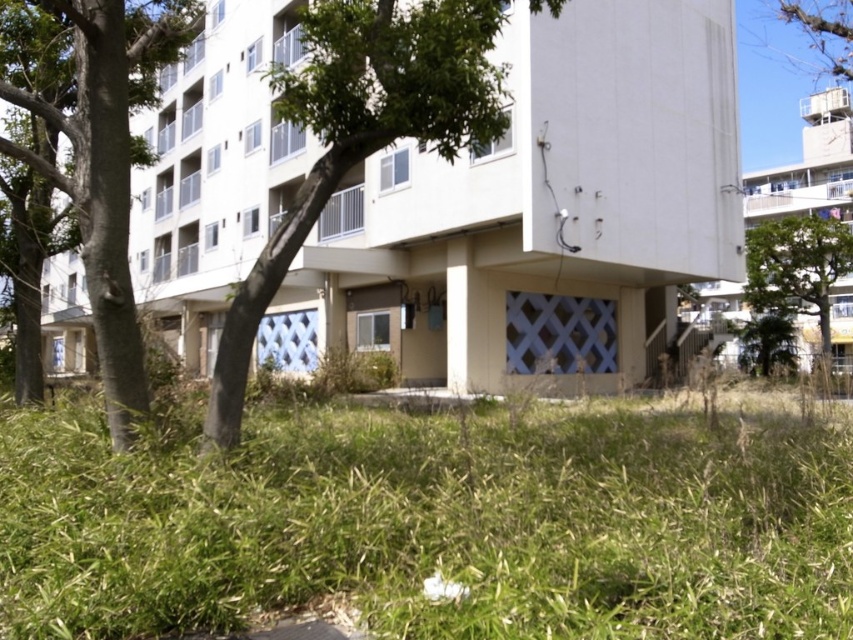
You are a gardener assessing the urban residential area. You notice the green grass at lower center and the green leafy tree at left. Which one has a smaller width?

The green grass at lower center has a smaller width than the green leafy tree at left.

You are standing at the point labeled point (434,524) in the image. What is the immediate surface you are standing on?

The point (434,524) corresponds to green grass at lower center, so you are standing on green grass at lower center.